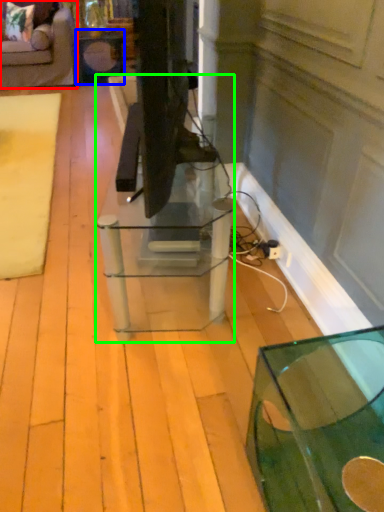
Question: Which is farther away from furniture (highlighted by a red box)? side table (highlighted by a blue box) or table (highlighted by a green box)?

Choices:
 (A) side table
 (B) table

Answer: (B)